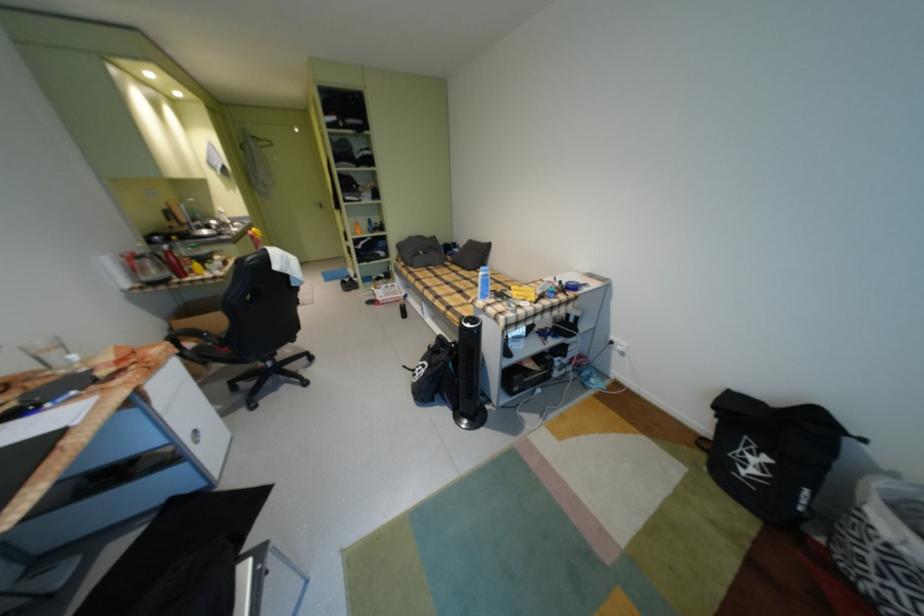
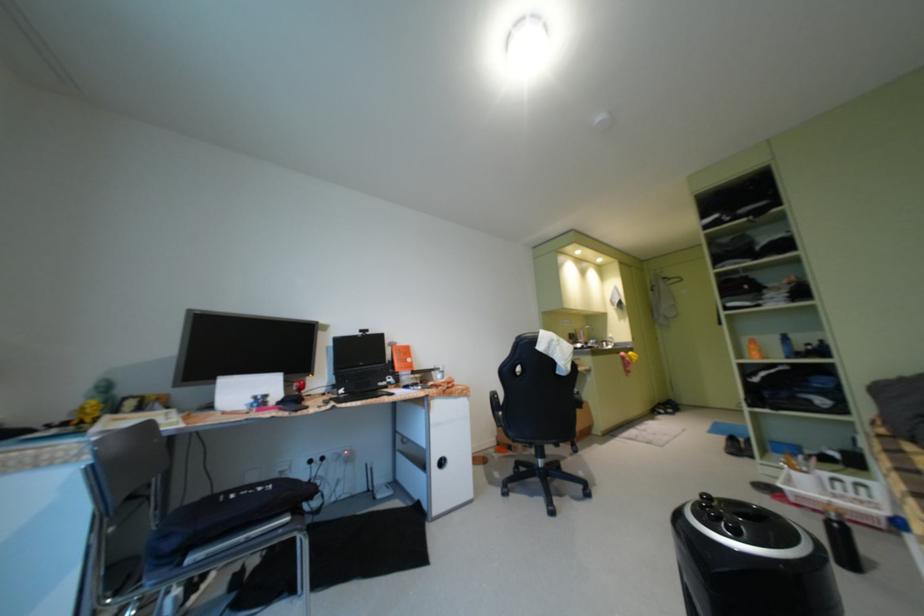
Question: The camera is either moving clockwise (left) or counter-clockwise (right) around the object. The first image is from the beginning of the video and the second image is from the end. Is the camera moving left or right when shooting the video?

Choices:
 (A) Left
 (B) Right

Answer: (B)